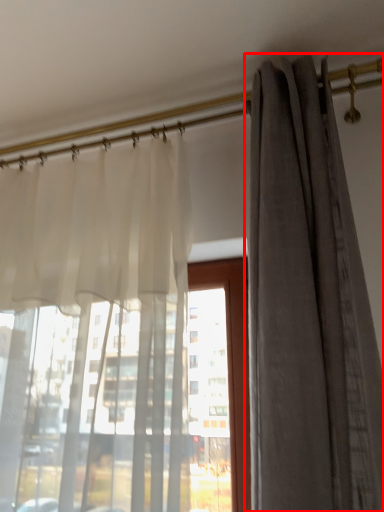
Question: Considering the relative positions of curtain (annotated by the red box) and curtain in the image provided, where is curtain (annotated by the red box) located with respect to the staircase?

Choices:
 (A) left
 (B) right

Answer: (B)